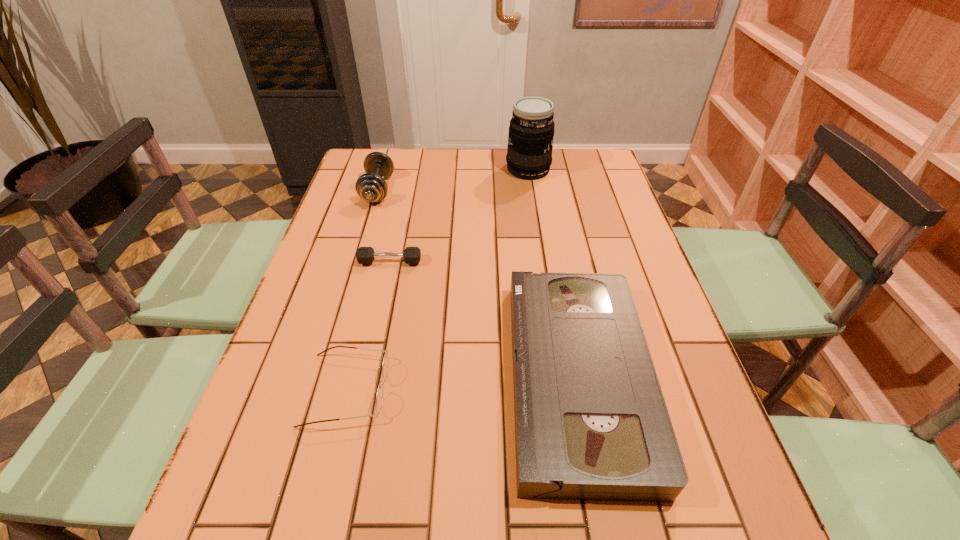
Identify the location of free space between the taller dumbbell and the third tallest object. (478, 284).

Locate an element on the screen. The width and height of the screenshot is (960, 540). the second closest object to the spectacles is located at coordinates (365, 255).

Find the location of a particular element. object that is the third closest one to the nearer dumbbell is located at coordinates (379, 397).

Locate an element on the screen. Image resolution: width=960 pixels, height=540 pixels. free point that satisfies the following two spatial constraints: 1. on the front side of the fourth shortest object; 2. on the right side of the shortest object is located at coordinates (356, 262).

Identify the location of free space that satisfies the following two spatial constraints: 1. on the front side of the videotape; 2. on the right side of the nearer dumbbell. (365, 377).